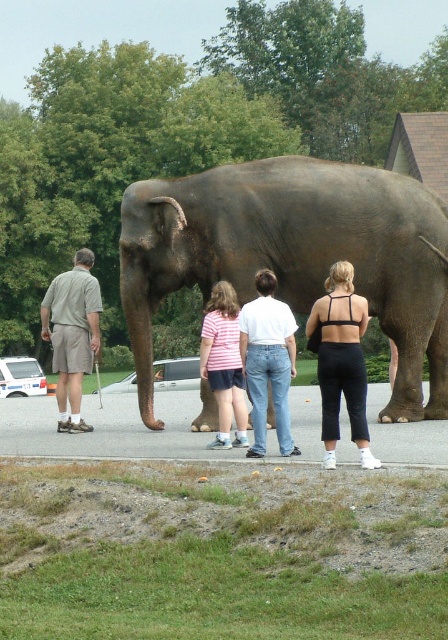
Consider the image. You are a tour guide leading a group near the elephant. You need to ensure everyone stays at least 15 feet away from the elephant for safety. The black matte pants at center and light brown shorts at left are two visitors in your group. Are these two visitors within the safe distance requirement?

The distance between the black matte pants at center and light brown shorts at left is 14.37 feet, which is less than the required 15 feet. Therefore, these visitors are too close to the elephant and need to move back to maintain the safe distance.

You are a tour guide leading a group near the gray textured elephant at center. You notice a tourist wearing light brown shorts at left is approaching the elephant. Based on the safety guidelines that state a minimum distance of 2 meters must be maintained between visitors and the elephants, is the tourist currently violating the safety distance rule?

The gray textured elephant at center and light brown shorts at left are 2.18 meters apart from each other. Since the required minimum distance is 2 meters, the tourist is not violating the safety distance rule as they are slightly over the required distance.